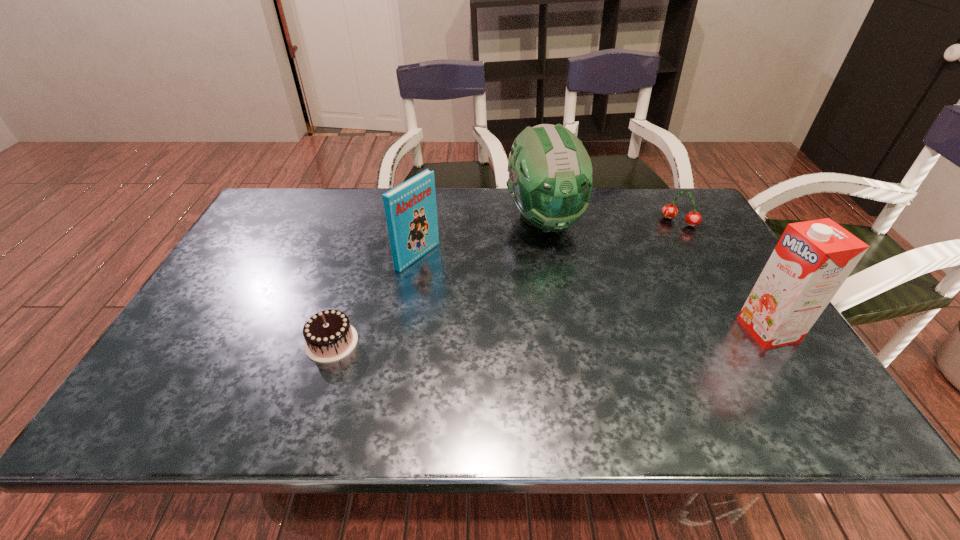
I want to click on free space located 0.310m with stems pointing upwards on the cherry, so click(x=632, y=283).

What are the coordinates of `vacant space positioned with stems pointing upwards on the cherry` in the screenshot? It's located at (632, 283).

In order to click on vacant space located 0.280m on the front cover of the fourth object from right to left in this screenshot , I will do `click(516, 310)`.

Locate an element on the screen. This screenshot has height=540, width=960. vacant area located on the front cover of the fourth object from right to left is located at coordinates (523, 314).

The height and width of the screenshot is (540, 960). Find the location of `free space located on the front cover of the fourth object from right to left`. free space located on the front cover of the fourth object from right to left is located at coordinates (548, 326).

Locate an element on the screen. vacant space situated on the visor of the football helmet is located at coordinates (567, 269).

Find the location of a particular element. The height and width of the screenshot is (540, 960). vacant space positioned 0.260m on the visor of the football helmet is located at coordinates (590, 313).

The width and height of the screenshot is (960, 540). Identify the location of vacant space located 0.210m on the visor of the football helmet. (583, 299).

You are a GUI agent. You are given a task and a screenshot of the screen. Output one action in this format:
    pyautogui.click(x=<x>, y=<y>)
    Task: Click on the cherry that is positioned at the far edge
    The image size is (960, 540).
    Given the screenshot: What is the action you would take?
    pyautogui.click(x=669, y=211)

Locate an element on the screen. football helmet present at the far edge is located at coordinates (550, 181).